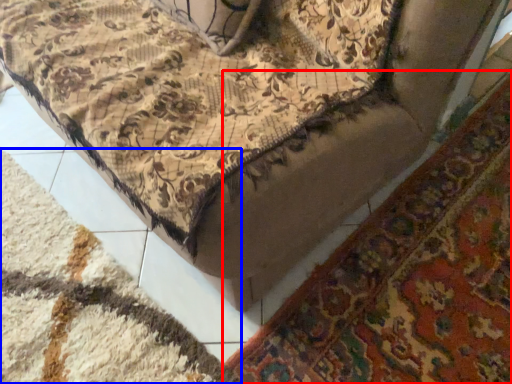
Question: Which object appears closest to the camera in this image, mat (highlighted by a red box) or mat (highlighted by a blue box)?

Choices:
 (A) mat
 (B) mat

Answer: (B)